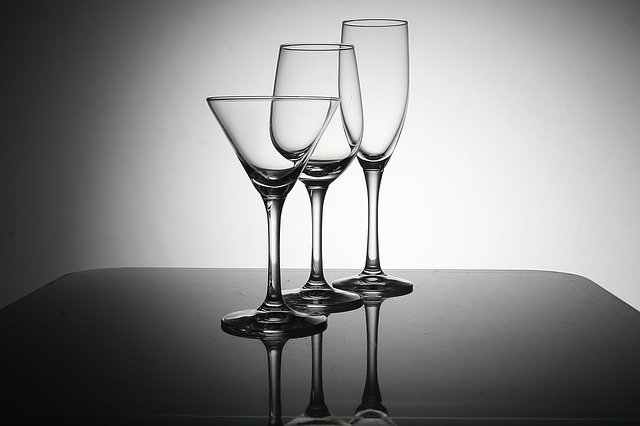
Locate an element on the screen. The image size is (640, 426). glass is located at coordinates (268, 155), (328, 78), (387, 71), (378, 409), (320, 406), (273, 420).